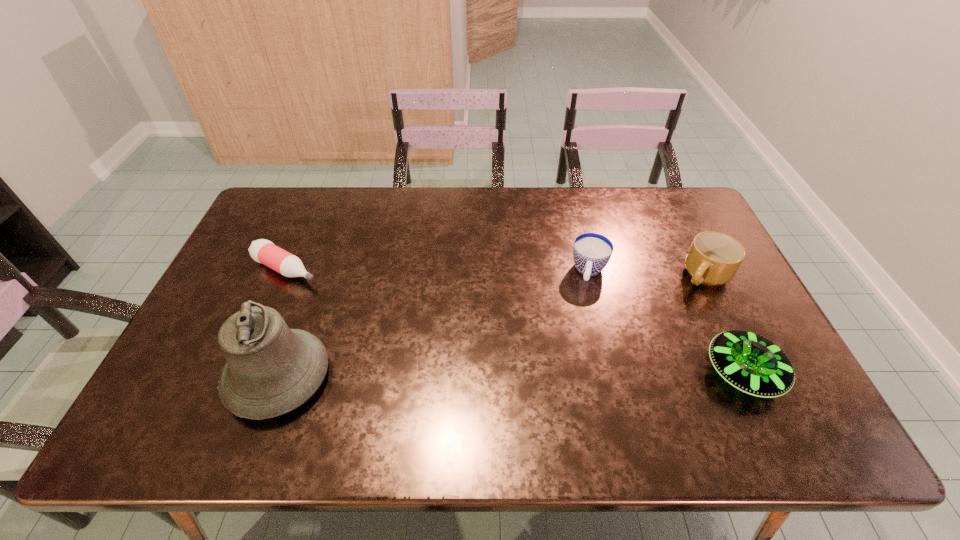
Choose which object is the second nearest neighbor to the bell. Please provide its 2D coordinates. Your answer should be formatted as a tuple, i.e. [(x, y)], where the tuple contains the x and y coordinates of a point satisfying the conditions above.

[(591, 252)]

What are the coordinates of `vacant position in the image that satisfies the following two spatial constraints: 1. on the front side of the shortest object; 2. on the right side of the tallest object` in the screenshot? It's located at (238, 377).

Where is `free spot that satisfies the following two spatial constraints: 1. on the back side of the bell; 2. on the right side of the third object from left to right`? This screenshot has height=540, width=960. free spot that satisfies the following two spatial constraints: 1. on the back side of the bell; 2. on the right side of the third object from left to right is located at coordinates (317, 271).

The image size is (960, 540). Find the location of `free spot that satisfies the following two spatial constraints: 1. on the front side of the third object from right to left; 2. on the right side of the mug`. free spot that satisfies the following two spatial constraints: 1. on the front side of the third object from right to left; 2. on the right side of the mug is located at coordinates pos(590,276).

Locate an element on the screen. This screenshot has height=540, width=960. vacant area in the image that satisfies the following two spatial constraints: 1. on the back side of the third object from right to left; 2. on the left side of the bell is located at coordinates (317, 271).